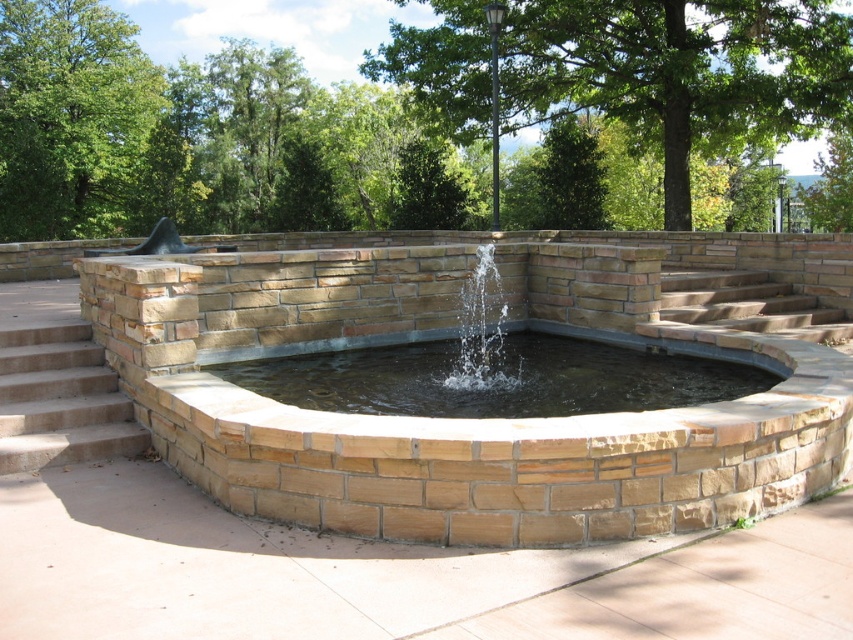
You are a landscape architect designing a pathway that needs to be elevated above the brown stone fountain at center and the concrete stairs at lower left. Which structure requires the pathway to be higher?

The concrete stairs at lower left are taller than the brown stone fountain at center, so the pathway must be elevated higher than the concrete stairs at lower left to be above both structures.

You are standing at the entrance of the garden and want to locate the brown stone fountain at center. According to the coordinates provided, where should you look relative to your current position?

The brown stone fountain at center is located at coordinates point (473, 419), so you should look to the right and slightly forward from your current position at the entrance.

You are standing at point (473, 419) in the image. What object is located exactly at your current position?

The brown stone fountain at center is located exactly at point (473, 419).